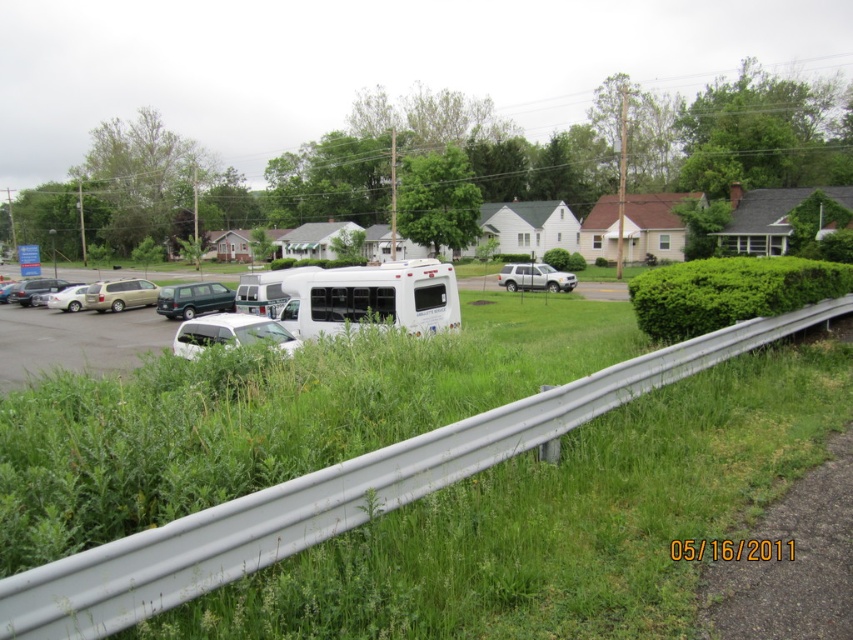
Is green leafy hedge at center to the left of white matte van at center from the viewer's perspective?

In fact, green leafy hedge at center is to the right of white matte van at center.

I want to click on green leafy hedge at center, so click(729, 291).

Identify the location of green leafy hedge at center. (729, 291).

The height and width of the screenshot is (640, 853). What are the coordinates of `green leafy hedge at center` in the screenshot? It's located at (729, 291).

At what (x,y) coordinates should I click in order to perform the action: click on white matte van at center. Please return your answer as a coordinate pair (x, y). This screenshot has width=853, height=640. Looking at the image, I should click on tap(74, 339).

Between point (136, 308) and point (51, 307), which one is positioned behind?

The point (51, 307) is behind.

Is point (109, 324) closer to camera compared to point (80, 307)?

Yes, point (109, 324) is closer to viewer.

Identify the location of white matte van at center. (74, 339).

Which of these two, green grass at center or green leafy hedge at center, stands taller?

Standing taller between the two is green leafy hedge at center.

Image resolution: width=853 pixels, height=640 pixels. What do you see at coordinates (340, 496) in the screenshot?
I see `green grass at center` at bounding box center [340, 496].

Is point (473, 426) less distant than point (837, 273)?

Yes, point (473, 426) is in front of point (837, 273).

This screenshot has width=853, height=640. Find the location of `green grass at center`. green grass at center is located at coordinates (340, 496).